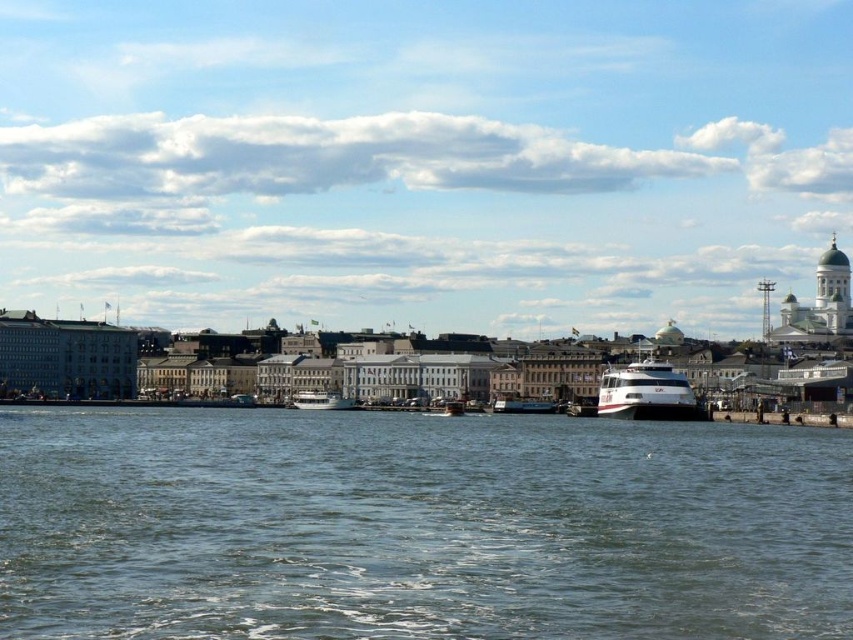
Which is behind, point (547, 403) or point (318, 400)?

The point (318, 400) is behind.

Between point (495, 396) and point (293, 396), which one is positioned in front?

Point (495, 396)

The width and height of the screenshot is (853, 640). I want to click on metallic blue boat at center, so click(521, 404).

Where is `metallic blue boat at center`? Image resolution: width=853 pixels, height=640 pixels. metallic blue boat at center is located at coordinates (521, 404).

Does blue water at center have a greater height compared to white glossy ferry at center?

Incorrect, blue water at center's height is not larger of white glossy ferry at center's.

Is point (461, 512) farther from camera compared to point (683, 417)?

No, it is in front of (683, 417).

Who is more distant from viewer, (502, 584) or (625, 381)?

The point (625, 381) is more distant.

This screenshot has width=853, height=640. What are the coordinates of `blue water at center` in the screenshot? It's located at (418, 525).

Does white glossy ferry at center appear on the right side of white glossy boat at center?

Correct, you'll find white glossy ferry at center to the right of white glossy boat at center.

Who is lower down, white glossy ferry at center or white glossy boat at center?

Positioned lower is white glossy boat at center.

Is point (664, 417) positioned before point (323, 394)?

Yes, point (664, 417) is closer to viewer.

Identify the location of white glossy ferry at center. coord(647,394).